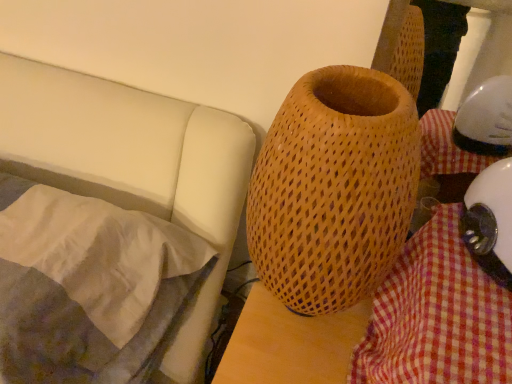
Question: From the image's perspective, relative to wooden textured vase at center, is white glossy helmet at lower right above or below?

Choices:
 (A) above
 (B) below

Answer: (B)

Question: From a real-world perspective, is white glossy helmet at lower right above or below wooden textured vase at center?

Choices:
 (A) above
 (B) below

Answer: (A)

Question: Estimate the real-world distances between objects in this image. Which object is farther from the checkered fabric at lower right?

Choices:
 (A) silky white pillow at left
 (B) white glossy helmet at lower right
 (C) wooden textured vase at center

Answer: (A)

Question: Which is nearer to the silky white pillow at left?

Choices:
 (A) checkered fabric at lower right
 (B) white glossy helmet at lower right
 (C) wooden textured vase at center

Answer: (C)